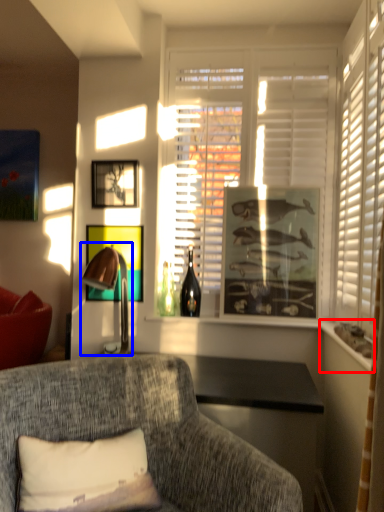
Question: Which object appears farthest to the camera in this image, window sill (highlighted by a red box) or table lamp (highlighted by a blue box)?

Choices:
 (A) window sill
 (B) table lamp

Answer: (B)